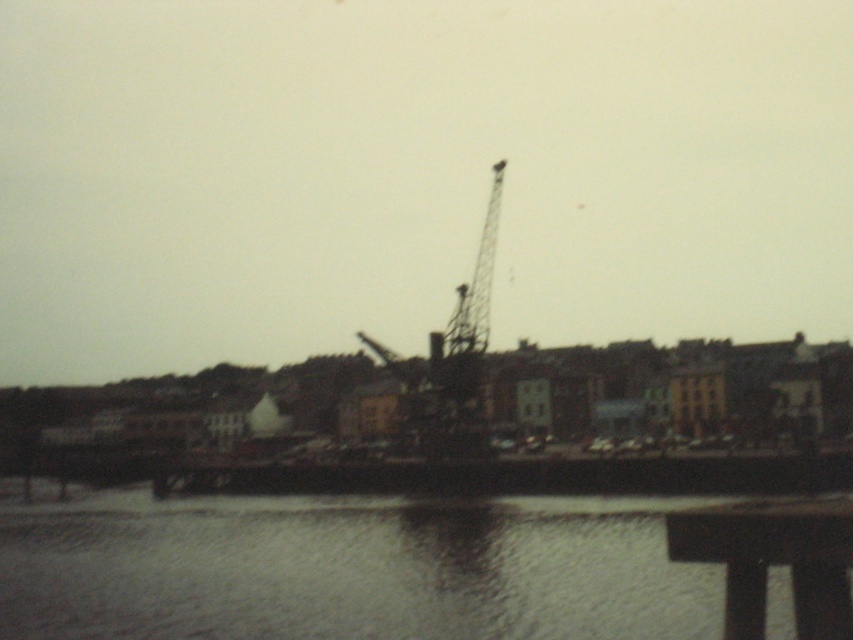
Question: Can you confirm if smooth water at lower center is positioned below metallic tower crane at center?

Choices:
 (A) yes
 (B) no

Answer: (A)

Question: Observing the image, what is the correct spatial positioning of smooth water at lower center in reference to metallic tower crane at center?

Choices:
 (A) left
 (B) right

Answer: (A)

Question: Which of the following is the farthest from the observer?

Choices:
 (A) (492, 164)
 (B) (703, 595)
 (C) (848, 541)

Answer: (A)

Question: Can you confirm if smooth water at lower center is bigger than metallic tower crane at center?

Choices:
 (A) no
 (B) yes

Answer: (A)

Question: Which object is closer to the camera taking this photo?

Choices:
 (A) smooth water at lower center
 (B) smooth dark wood dock at lower right
 (C) metallic tower crane at center

Answer: (B)

Question: Among these objects, which one is nearest to the camera?

Choices:
 (A) smooth water at lower center
 (B) metallic tower crane at center

Answer: (A)